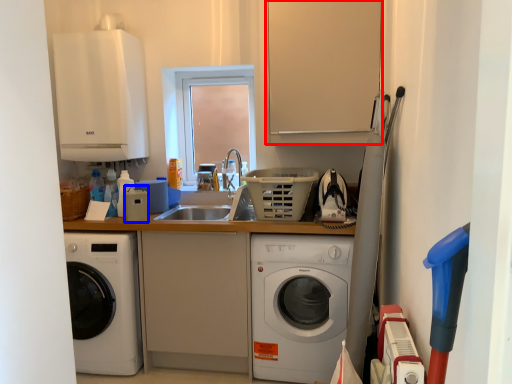
Question: Which of the following is the closest to the observer, cabinetry (highlighted by a red box) or appliance (highlighted by a blue box)?

Choices:
 (A) cabinetry
 (B) appliance

Answer: (A)